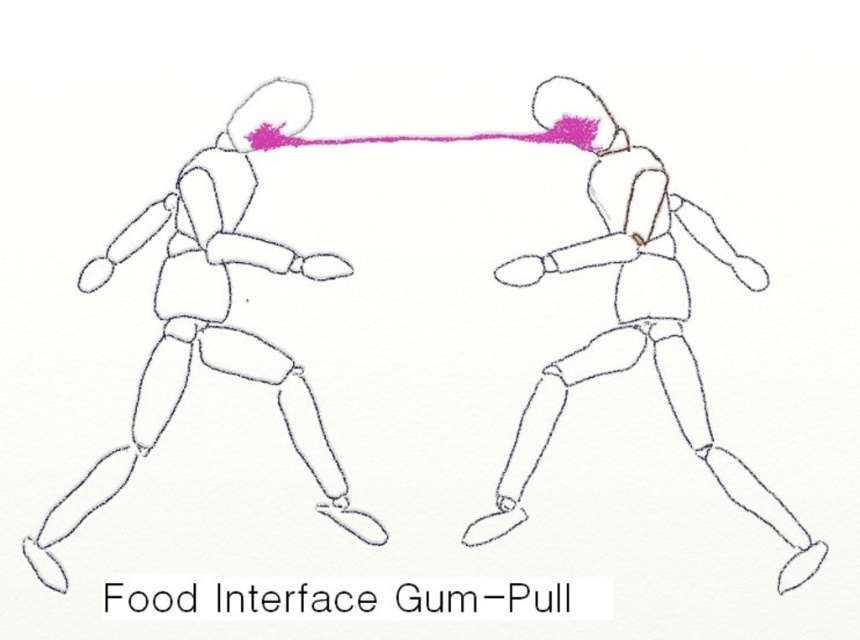
Between matte black figure at left and smooth white figure at center, which one appears on the left side from the viewer's perspective?

Positioned to the left is matte black figure at left.

Who is positioned more to the right, matte black figure at left or smooth white figure at center?

Positioned to the right is smooth white figure at center.

Is point (306, 438) less distant than point (579, 253)?

That is True.

Locate an element on the screen. Image resolution: width=860 pixels, height=640 pixels. matte black figure at left is located at coordinates (210, 317).